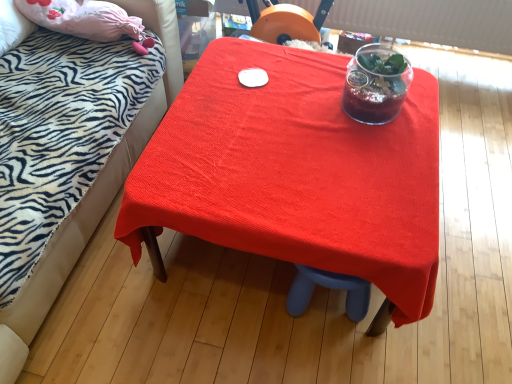
Question: Is zebra-patterned fabric bed at upper left situated inside translucent glass vase at upper center or outside?

Choices:
 (A) outside
 (B) inside

Answer: (A)

Question: Considering the positions of point (15, 304) and point (382, 119), is point (15, 304) closer or farther from the camera than point (382, 119)?

Choices:
 (A) farther
 (B) closer

Answer: (B)

Question: Which object is positioned farthest from the translucent glass vase at upper center?

Choices:
 (A) zebra-patterned fabric bed at upper left
 (B) smooth red tablecloth at center

Answer: (A)

Question: Estimate the real-world distances between objects in this image. Which object is farther from the smooth red tablecloth at center?

Choices:
 (A) translucent glass vase at upper center
 (B) zebra-patterned fabric bed at upper left

Answer: (B)